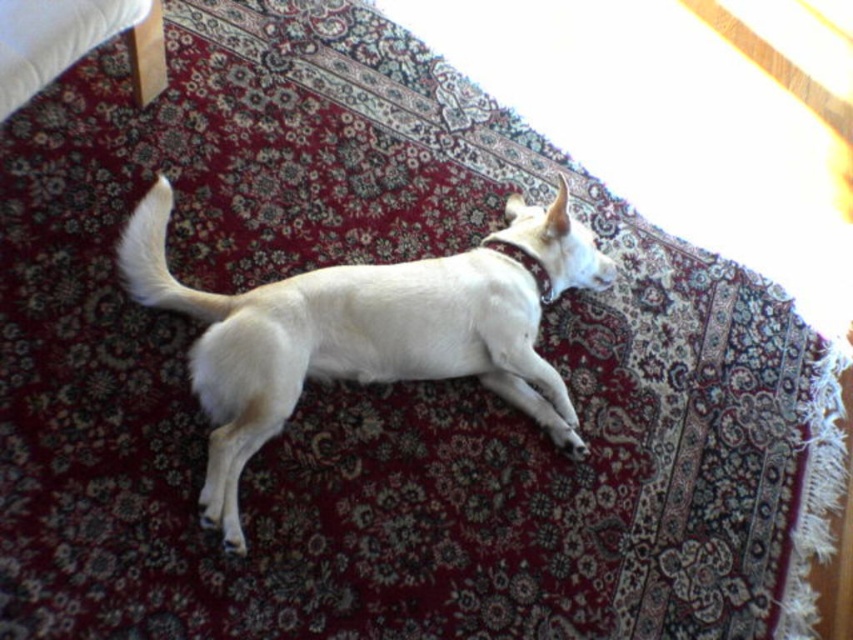
Question: Can you confirm if white fur dog at center is bigger than maroon leather neckband at upper center?

Choices:
 (A) yes
 (B) no

Answer: (A)

Question: Is white fur dog at center to the left of maroon leather neckband at upper center from the viewer's perspective?

Choices:
 (A) yes
 (B) no

Answer: (A)

Question: Is white fur dog at center below maroon leather neckband at upper center?

Choices:
 (A) yes
 (B) no

Answer: (A)

Question: Among these objects, which one is farthest from the camera?

Choices:
 (A) maroon leather neckband at upper center
 (B) white fur dog at center

Answer: (A)

Question: Among these objects, which one is farthest from the camera?

Choices:
 (A) white fur dog at center
 (B) maroon leather neckband at upper center

Answer: (B)

Question: Which object appears farthest from the camera in this image?

Choices:
 (A) maroon leather neckband at upper center
 (B) white fur dog at center

Answer: (A)